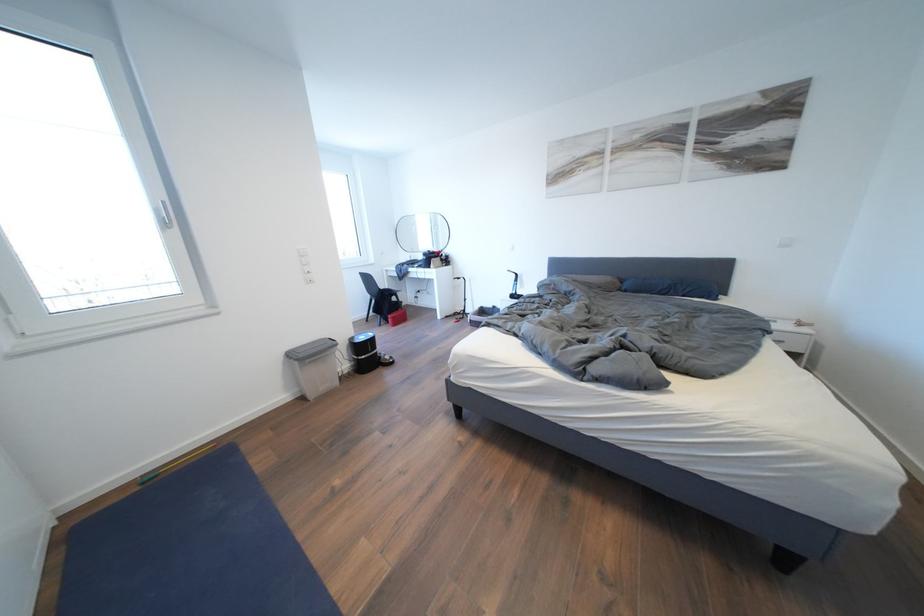
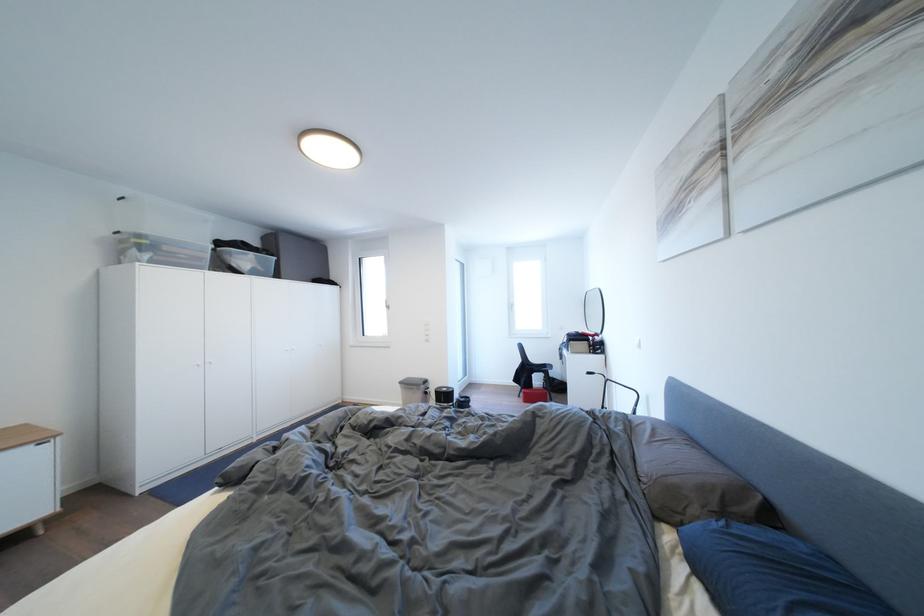
Find the pixel in the second image that matches (x=400, y=323) in the first image.

(532, 398)